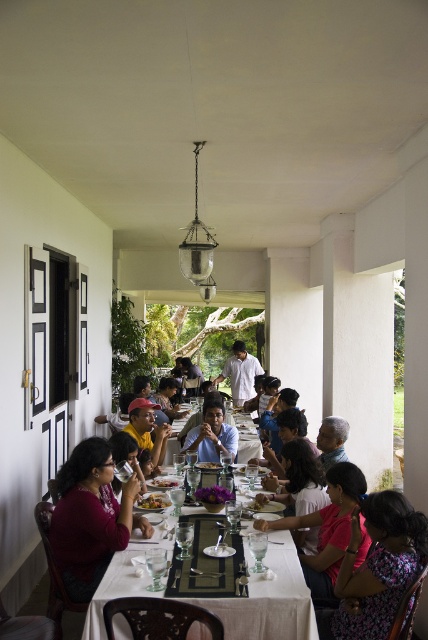
Can you confirm if floral fabric dress at lower right is thinner than matte black cap at center?

No, floral fabric dress at lower right is not thinner than matte black cap at center.

Is floral fabric dress at lower right shorter than matte black cap at center?

No, floral fabric dress at lower right is not shorter than matte black cap at center.

Which is behind, point (398, 566) or point (130, 404)?

Positioned behind is point (130, 404).

Find the location of a particular element. This screenshot has height=640, width=428. floral fabric dress at lower right is located at coordinates (379, 564).

In the scene shown: Does blue shirt at center appear on the right side of gray hair at center?

No, blue shirt at center is not to the right of gray hair at center.

Is point (216, 401) farther from camera compared to point (323, 422)?

Yes, it is.

Who is more forward, (187, 444) or (324, 460)?

Point (324, 460) is more forward.

Identify the location of blue shirt at center. (211, 435).

Is point (149, 508) farther from viewer compared to point (219, 461)?

No, it is in front of (219, 461).

Which is more to the right, green leafy salad at center or smooth white plate at center?

smooth white plate at center is more to the right.

Between point (145, 509) and point (216, 470), which one is positioned in front?

Positioned in front is point (145, 509).

The width and height of the screenshot is (428, 640). I want to click on green leafy salad at center, so click(x=154, y=500).